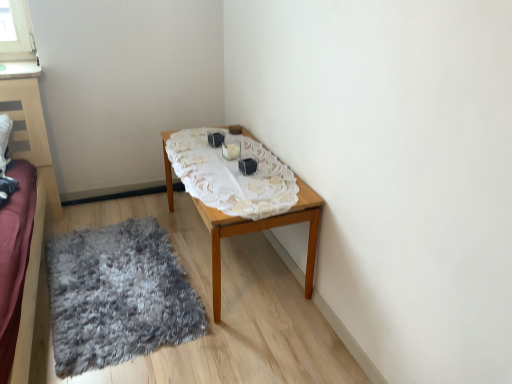
In order to click on free location to the right of gray shaggy rug at lower left in this screenshot , I will do `click(246, 297)`.